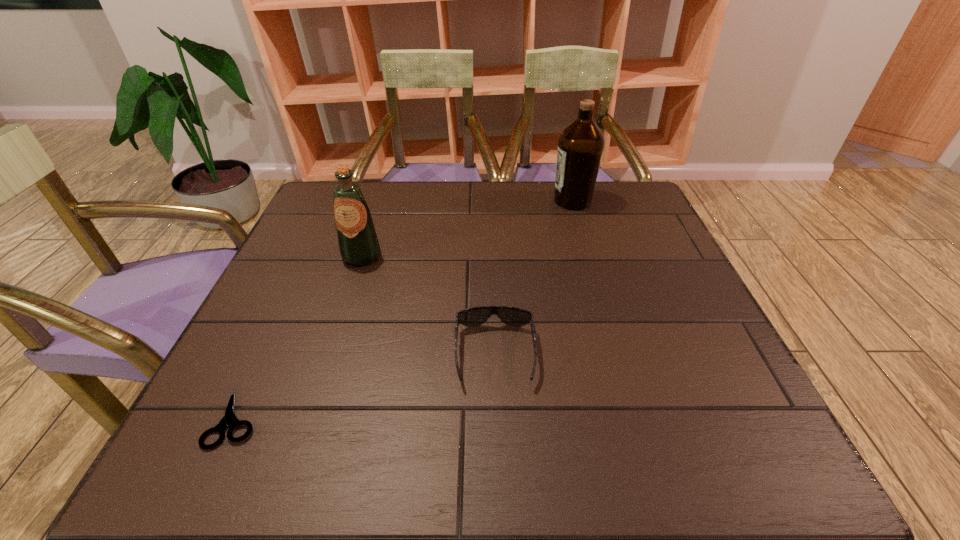
You are a GUI agent. You are given a task and a screenshot of the screen. Output one action in this format:
    pyautogui.click(x=<x>, y=<y>)
    Task: Click on the vacant space that is in between the taller olive oil and the leftmost object
    The image size is (960, 540).
    Given the screenshot: What is the action you would take?
    pyautogui.click(x=404, y=309)

Find the location of a particular element. The height and width of the screenshot is (540, 960). free spot between the third nearest object and the right olive oil is located at coordinates (467, 228).

In order to click on vacant point located between the right olive oil and the third shortest object in this screenshot , I will do `click(467, 228)`.

This screenshot has height=540, width=960. I want to click on empty space that is in between the leftmost object and the sunglasses, so click(x=366, y=386).

You are a GUI agent. You are given a task and a screenshot of the screen. Output one action in this format:
    pyautogui.click(x=<x>, y=<y>)
    Task: Click on the vacant area that lies between the shortest object and the rightmost object
    This screenshot has width=960, height=540.
    Given the screenshot: What is the action you would take?
    pyautogui.click(x=404, y=309)

Image resolution: width=960 pixels, height=540 pixels. I want to click on free area in between the shears and the nearer olive oil, so click(x=299, y=336).

Choose which object is the nearest neighbor to the third nearest object. Please provide its 2D coordinates. Your answer should be formatted as a tuple, i.e. [(x, y)], where the tuple contains the x and y coordinates of a point satisfying the conditions above.

[(513, 316)]

Identify the location of object that is the third closest to the second object from right to left. This screenshot has width=960, height=540. (581, 144).

I want to click on blank space that satisfies the following two spatial constraints: 1. on the label of the right olive oil; 2. on the front-facing side of the sunglasses, so click(618, 354).

Locate an element on the screen. This screenshot has height=540, width=960. free location that satisfies the following two spatial constraints: 1. on the label of the tallest object; 2. on the front side of the shears is located at coordinates pyautogui.click(x=637, y=417).